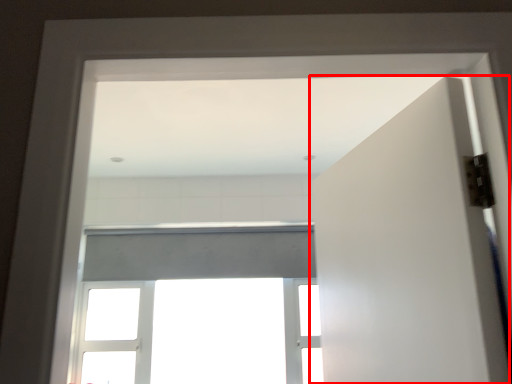
Question: From the image, what is the correct spatial relationship of door (annotated by the red box) in relation to window?

Choices:
 (A) left
 (B) right

Answer: (B)